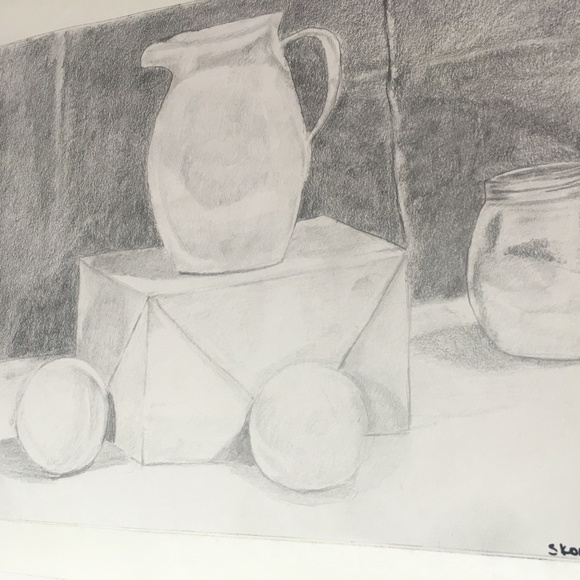
This screenshot has height=580, width=580. What are the coordinates of `wall` in the screenshot? It's located at (45, 87).